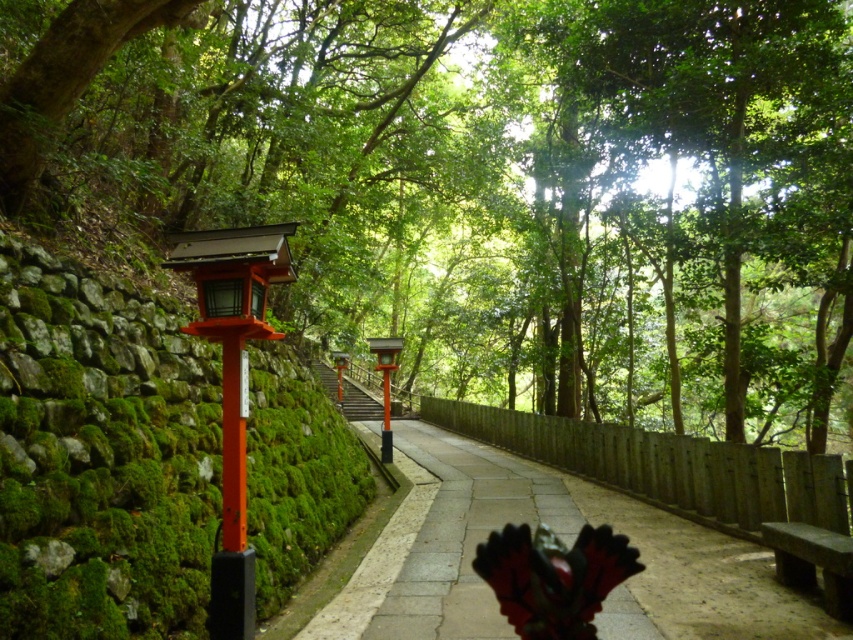
You are a visitor walking along the pathway and want to sit down on the dark gray stone bench at lower right. Before you reach it, you notice the green leafy tree at center. Will the tree block your path to the bench?

The green leafy tree at center is positioned over dark gray stone bench at lower right, so the tree is above the bench and does not block the path to it. You can walk freely to the bench without obstruction.

You are a hiker who wants to rest under the shade. The green leafy tree at center and the dark gray stone bench at lower right are both available. Which one do you think provides more shade coverage?

The green leafy tree at center provides more shade coverage because it is taller than the dark gray stone bench at lower right.

You are standing at the entrance of the pathway and want to take a photo of the green leafy tree at center. Based on its position, where should you aim your camera to capture it in the frame?

The green leafy tree at center is located at point coordinates approximately 0.283 on the x axis and 0.562 on the y axis. This means it is positioned slightly to the left and lower middle of the image, so aim your camera slightly left and down from the center to capture it.